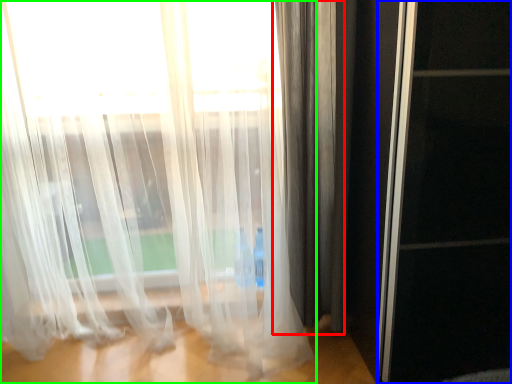
Question: Which object is the closest to the curtain (highlighted by a red box)? Choose among these: screen door (highlighted by a blue box) or curtain (highlighted by a green box).

Choices:
 (A) screen door
 (B) curtain

Answer: (B)